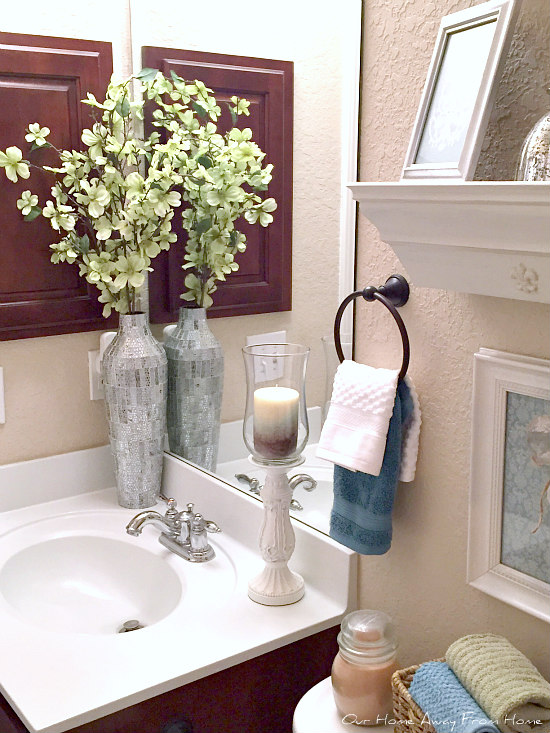
Find the location of a particular element. The height and width of the screenshot is (733, 550). cabinet is located at coordinates (251, 256).